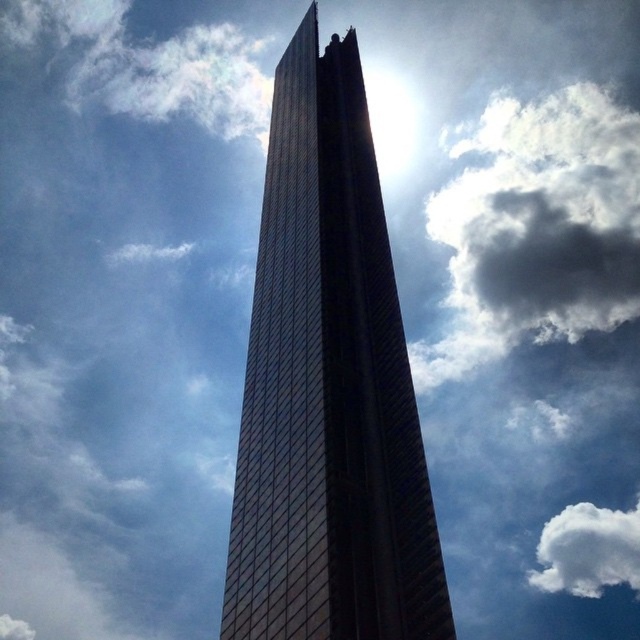
Question: Which of the following is the closest to the observer?

Choices:
 (A) shiny glass tower at center
 (B) white fluffy cloud at upper right

Answer: (A)

Question: Is shiny glass tower at center above white fluffy cloud at upper right?

Choices:
 (A) yes
 (B) no

Answer: (A)

Question: Is shiny glass tower at center above white fluffy cloud at upper right?

Choices:
 (A) no
 (B) yes

Answer: (B)

Question: In this image, where is shiny glass tower at center located relative to white fluffy cloud at upper right?

Choices:
 (A) below
 (B) above

Answer: (B)